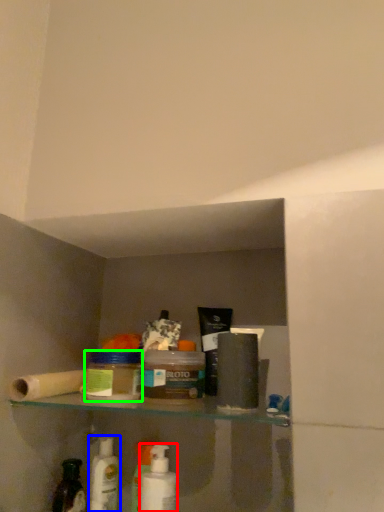
Question: Which is nearer to the mouthwash (highlighted by a red box)? mouthwash (highlighted by a blue box) or product (highlighted by a green box).

Choices:
 (A) mouthwash
 (B) product

Answer: (A)